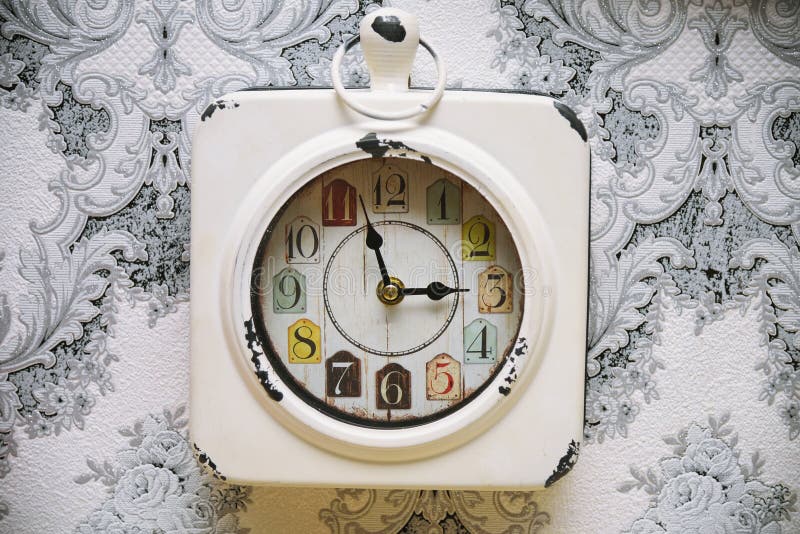
Locate an element on the screen. The width and height of the screenshot is (800, 534). floral pattern is located at coordinates (713, 265).